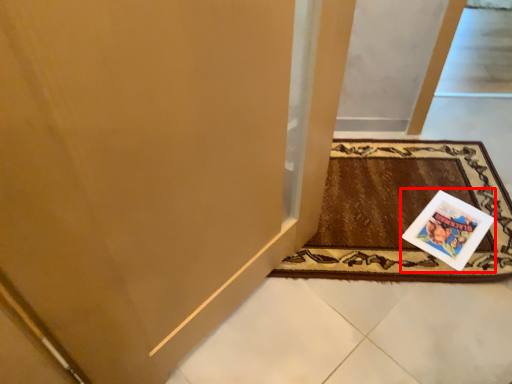
Question: From the image, what is the correct spatial relationship of postcard (annotated by the red box) in relation to mat?

Choices:
 (A) left
 (B) right

Answer: (B)